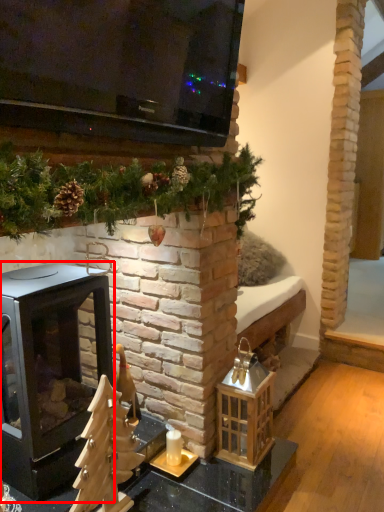
Question: From the image's perspective, where is wood burning stove (annotated by the red box) located in relation to candle holder in the image?

Choices:
 (A) below
 (B) above

Answer: (B)